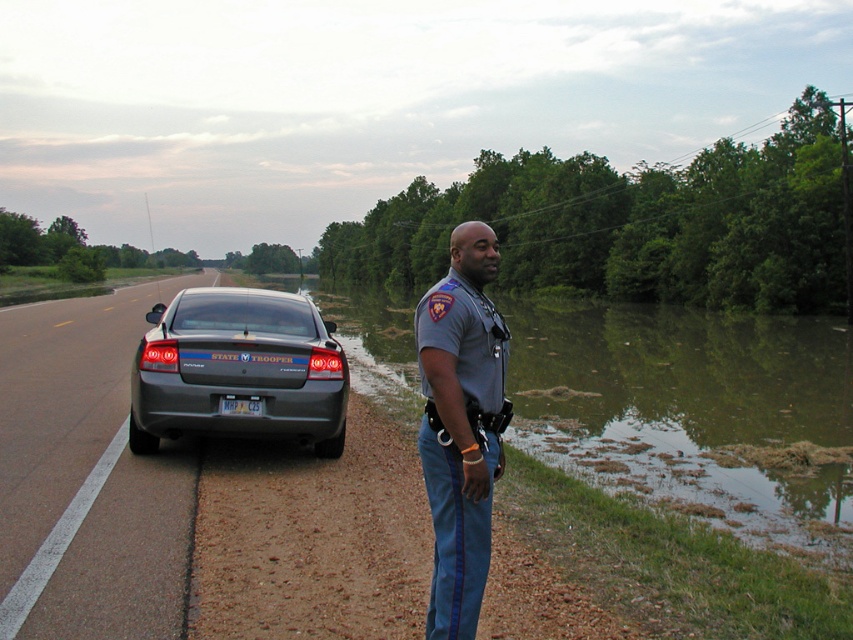
Is green muddy water at right further to camera compared to gray uniform at center?

Yes, it is.

Who is positioned more to the left, green muddy water at right or gray uniform at center?

gray uniform at center is more to the left.

Between point (570, 349) and point (456, 320), which one is positioned behind?

Positioned behind is point (570, 349).

Identify the location of green muddy water at right. The image size is (853, 640). (693, 413).

Can you confirm if satin gray sedan at center is taller than gray uniform at center?

In fact, satin gray sedan at center may be shorter than gray uniform at center.

Between satin gray sedan at center and gray uniform at center, which one is positioned lower?

gray uniform at center

Who is more distant from viewer, (260, 296) or (457, 236)?

The point (260, 296) is behind.

Where is `satin gray sedan at center`? This screenshot has width=853, height=640. satin gray sedan at center is located at coordinates (238, 369).

From the picture: Is green muddy water at right positioned at the back of metallic gray car at center-left?

Yes, it is behind metallic gray car at center-left.

Where is `green muddy water at right`? Image resolution: width=853 pixels, height=640 pixels. green muddy water at right is located at coordinates (693, 413).

At what (x,y) coordinates should I click in order to perform the action: click on green muddy water at right. Please return your answer as a coordinate pair (x, y). Looking at the image, I should click on point(693,413).